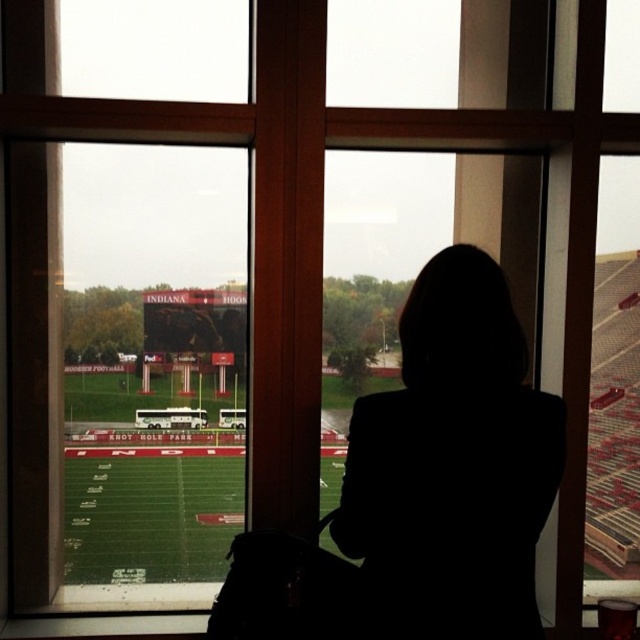
Consider the image. Who is positioned more to the left, green glass window at center or silhouette jacket at center?

green glass window at center

Is green glass window at center positioned in front of silhouette jacket at center?

No.

Does point (172, 433) come in front of point (524, 550)?

That is False.

The width and height of the screenshot is (640, 640). Find the location of `green glass window at center`. green glass window at center is located at coordinates (150, 372).